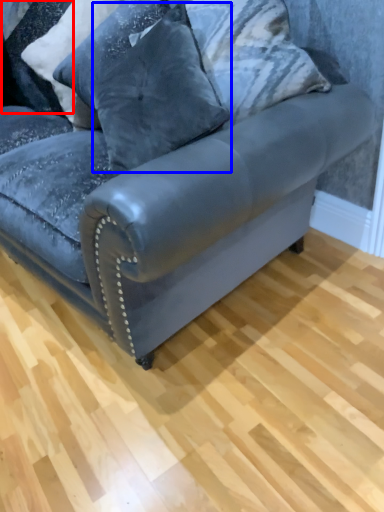
Question: Which object appears farthest to the camera in this image, pillow (highlighted by a red box) or pillow (highlighted by a blue box)?

Choices:
 (A) pillow
 (B) pillow

Answer: (A)